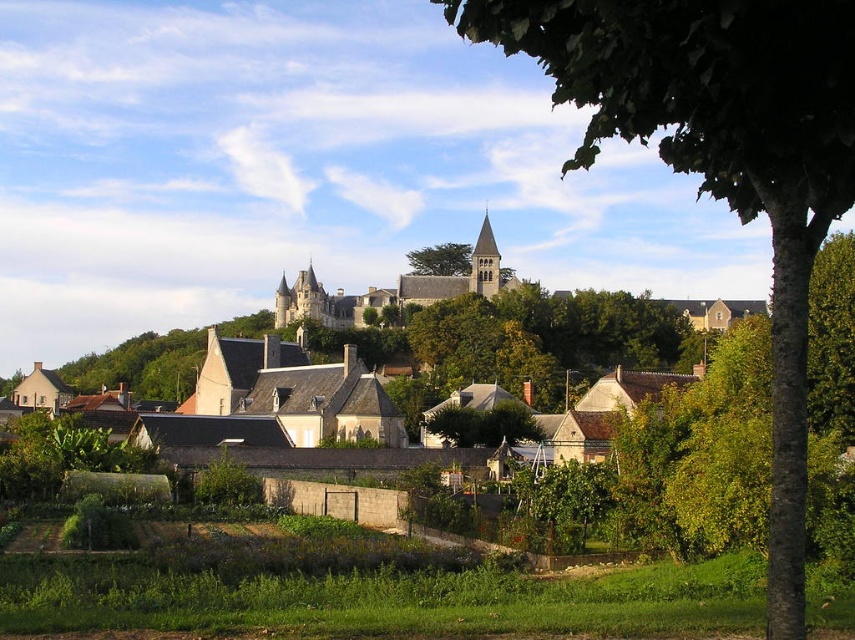
You are a visitor standing in the garden and want to take a photo of the stone castle at center without any obstructions. Since the green leafy tree at center is in the way, can you move to the right side of the garden to get a clear view?

The stone castle at center is positioned under the green leafy tree at center, so moving to the right side of the garden might still leave the tree obstructing the view unless you move far enough to the right to position yourself outside the tree canopy.

You are standing in the rural landscape scene and want to take a photo of the green leafy tree at upper right. If your camera can focus on objects up to 30 meters away, will it be able to capture the tree clearly?

The green leafy tree at upper right is 30.53 meters away from the camera, which exceeds the camera focus limit of 30 meters. Therefore, the camera will not be able to capture the tree clearly.

Based on the photo, you are standing in the garden looking towards the houses. You see a green leafy tree at upper right and a green leafy tree at center. Which tree is higher up in your field of view?

The green leafy tree at upper right is higher up in your field of view because it is positioned above the green leafy tree at center.